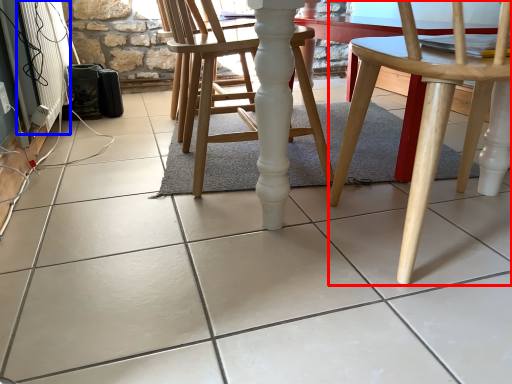
Question: Which point is further to the camera, chair (highlighted by a red box) or radiator (highlighted by a blue box)?

Choices:
 (A) chair
 (B) radiator

Answer: (B)